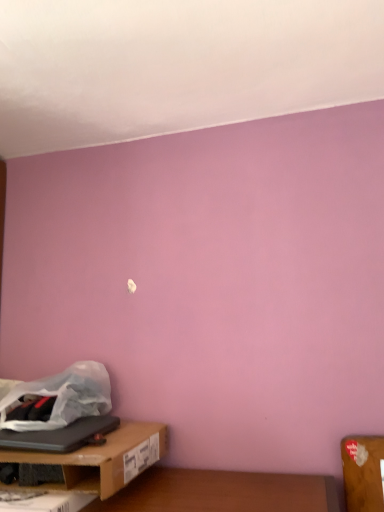
Question: From the image's perspective, is black matte laptop at lower left located above or below brown cardboard box at lower left?

Choices:
 (A) above
 (B) below

Answer: (A)

Question: Based on their positions, is black matte laptop at lower left located to the left or right of brown cardboard box at lower left?

Choices:
 (A) right
 (B) left

Answer: (B)

Question: Which is nearer to the brown cardboard box at lower left?

Choices:
 (A) black matte laptop at lower left
 (B) translucent white plastic bag at lower left

Answer: (A)

Question: Which object is positioned closest to the translucent white plastic bag at lower left?

Choices:
 (A) black matte laptop at lower left
 (B) brown cardboard box at lower left

Answer: (A)